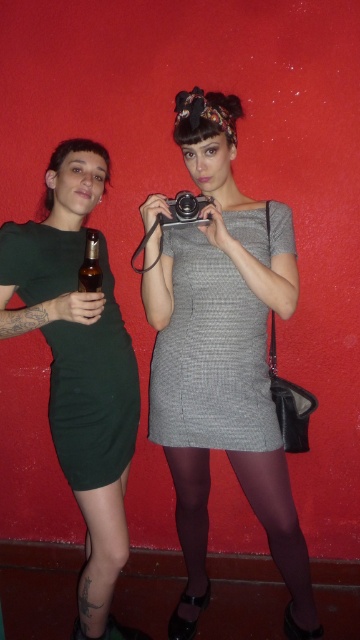
Question: Which is nearer to the matte green dress at left?

Choices:
 (A) dark green jersey dress at left
 (B) matte gray dress at center
 (C) oxblood sheer tights at lower center

Answer: (A)

Question: Which object is the farthest from the translucent amber glass bottle at left?

Choices:
 (A) black metallic camera at center
 (B) matte green dress at left
 (C) matte gray dress at center

Answer: (C)

Question: Does matte gray dress at center appear on the right side of oxblood sheer tights at lower center?

Choices:
 (A) no
 (B) yes

Answer: (A)

Question: Can you confirm if matte gray dress at center is wider than gray textured dress at center?

Choices:
 (A) yes
 (B) no

Answer: (A)

Question: Does matte gray dress at center come in front of gray textured dress at center?

Choices:
 (A) yes
 (B) no

Answer: (A)

Question: Which of the following is the closest to the observer?

Choices:
 (A) (168, 365)
 (B) (105, 156)
 (C) (105, 394)

Answer: (C)